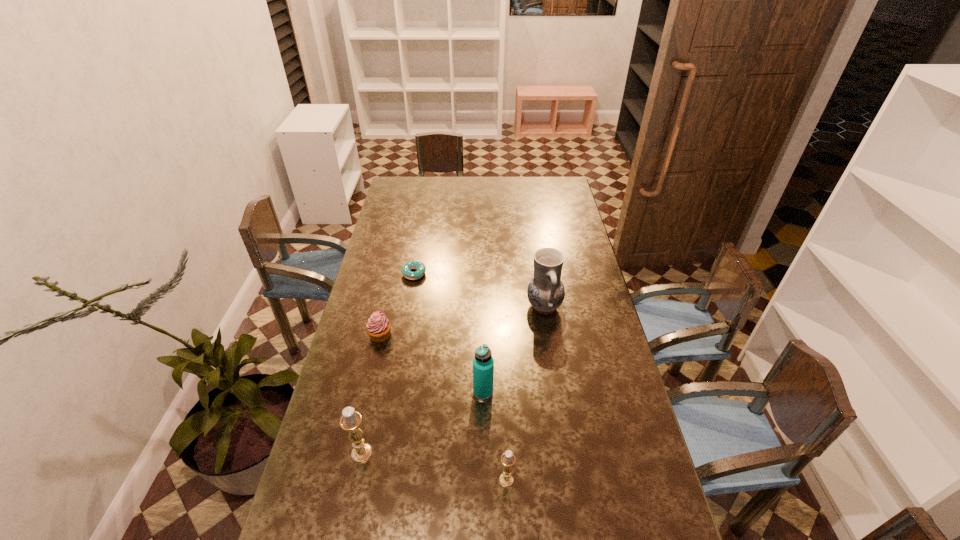
Where is `water bottle`? water bottle is located at coordinates (483, 364).

Where is `the fourth object from left to right`? The height and width of the screenshot is (540, 960). the fourth object from left to right is located at coordinates (483, 364).

At what (x,y) coordinates should I click in order to perform the action: click on free spot located 0.250m on the back of the taller candle holder. Please return your answer as a coordinate pair (x, y). The height and width of the screenshot is (540, 960). Looking at the image, I should click on (379, 371).

You are a GUI agent. You are given a task and a screenshot of the screen. Output one action in this format:
    pyautogui.click(x=<x>, y=<y>)
    Task: Click on the vacant area situated 0.210m on the left of the shorter candle holder
    This screenshot has width=960, height=540.
    Given the screenshot: What is the action you would take?
    pyautogui.click(x=420, y=480)

Locate an element on the screen. Image resolution: width=960 pixels, height=540 pixels. free space located 0.100m on the back of the pottery is located at coordinates 540,273.

Identify the location of vacant space situated 0.180m on the right of the farthest object. This screenshot has height=540, width=960. 470,274.

Locate an element on the screen. This screenshot has width=960, height=540. vacant space situated on the right of the third farthest object is located at coordinates (426, 335).

Image resolution: width=960 pixels, height=540 pixels. Find the location of `free space located on the left of the water bottle`. free space located on the left of the water bottle is located at coordinates (457, 392).

The width and height of the screenshot is (960, 540). What are the coordinates of `candle holder present at the left edge` in the screenshot? It's located at (351, 420).

Locate an element on the screen. This screenshot has height=540, width=960. doughnut located in the left edge section of the desktop is located at coordinates (419, 266).